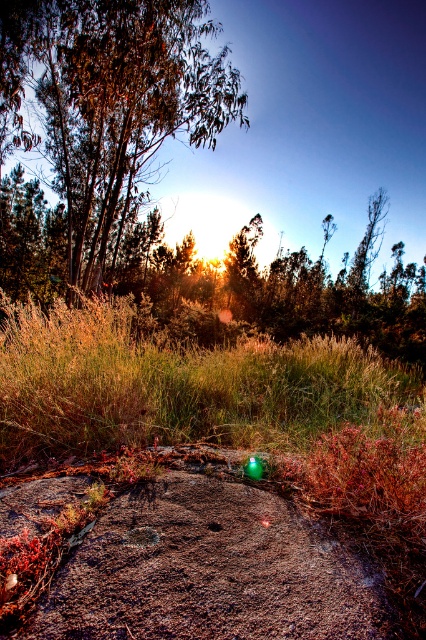
Is green leafy tree at upper left in front of golden grass at center?

No.

Between point (103, 148) and point (224, 435), which one is positioned in front?

Point (224, 435) is in front.

Locate an element on the screen. This screenshot has width=426, height=640. green leafy tree at upper left is located at coordinates (103, 118).